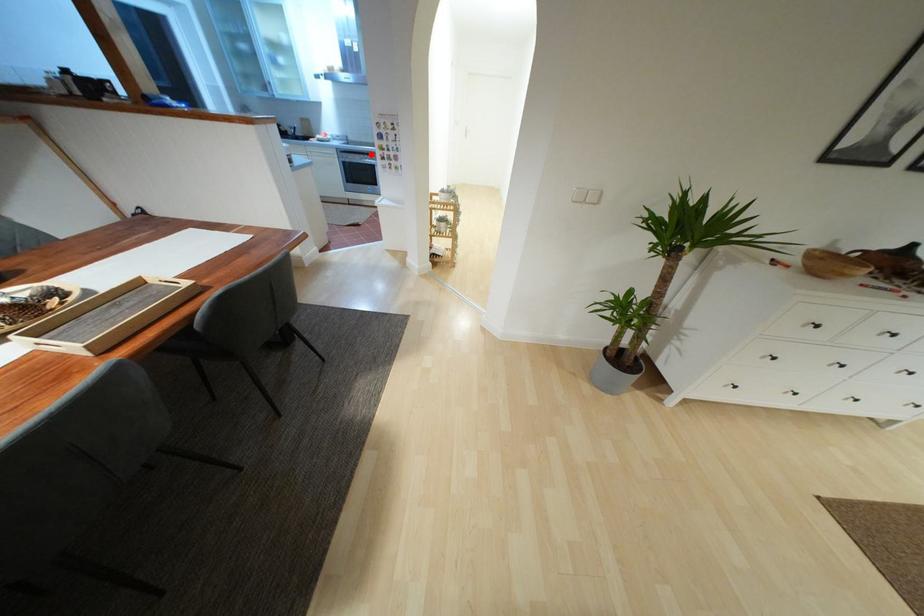
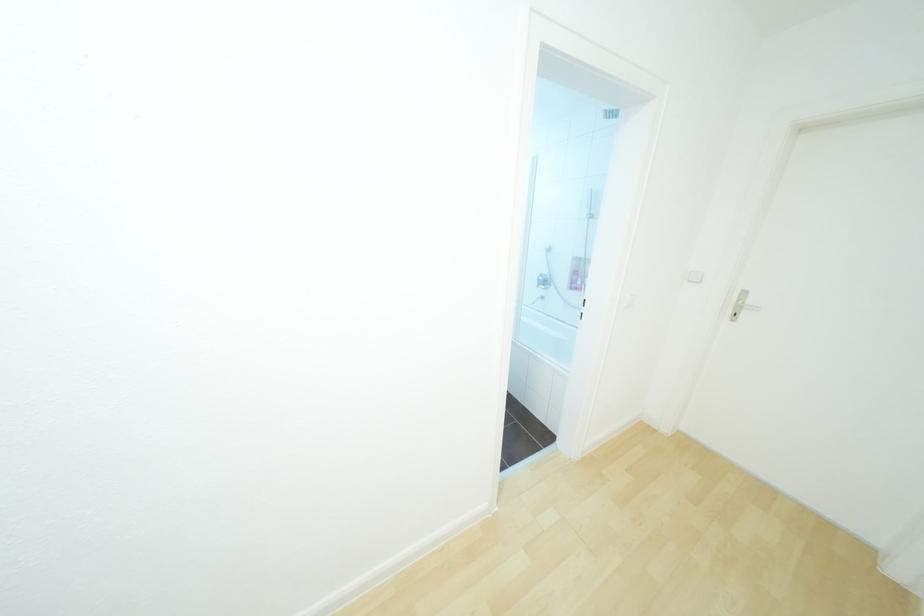
Question: I am providing you with two images of the same scene from different viewpoints. A red point is marked on the first image. Is the red point's position out of view in image 2?

Choices:
 (A) Yes
 (B) No

Answer: (A)